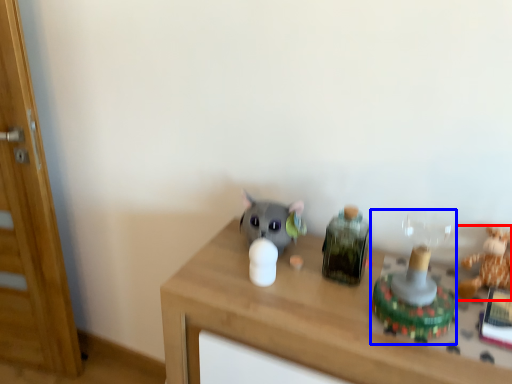
Question: Which object appears farthest to the camera in this image, toy (highlighted by a red box) or toy (highlighted by a blue box)?

Choices:
 (A) toy
 (B) toy

Answer: (A)